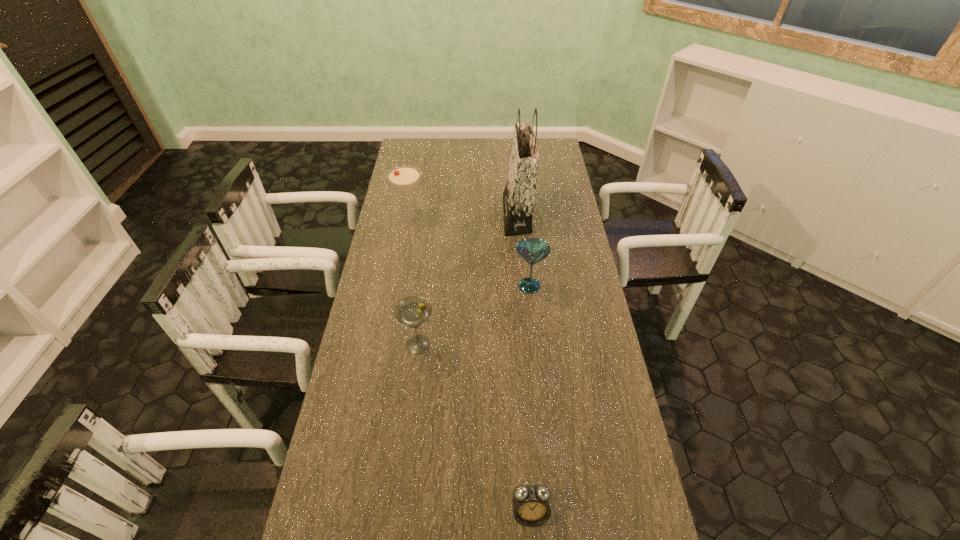
Where is `shopping bag`? This screenshot has height=540, width=960. shopping bag is located at coordinates tap(519, 194).

Find the location of a particular element. The height and width of the screenshot is (540, 960). the farthest martini is located at coordinates (404, 177).

The image size is (960, 540). I want to click on the second nearest object, so click(x=412, y=311).

Image resolution: width=960 pixels, height=540 pixels. I want to click on the rightmost martini, so click(533, 250).

Where is `the second nearest martini`? This screenshot has width=960, height=540. the second nearest martini is located at coordinates pos(533,250).

This screenshot has height=540, width=960. Find the location of `alarm clock`. alarm clock is located at coordinates (531, 507).

Locate an element on the screen. the nearest object is located at coordinates (531, 507).

The image size is (960, 540). I want to click on blank space located 0.100m on the front of the tallest object with the design, so click(479, 215).

Find the location of a particular element. The image size is (960, 540). vacant region located on the front of the tallest object with the design is located at coordinates (477, 215).

Where is `vacant area situated 0.230m on the front of the tallest object with the design`? vacant area situated 0.230m on the front of the tallest object with the design is located at coordinates (448, 215).